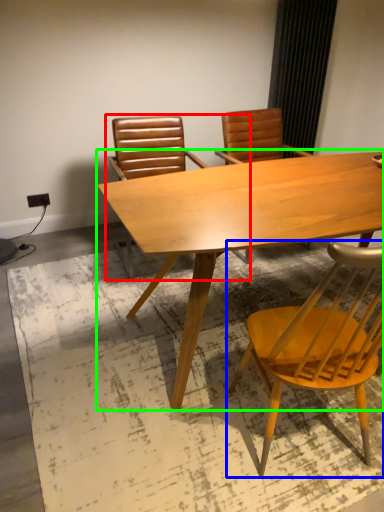
Question: Which object is the closest to the chair (highlighted by a red box)? Choose among these: chair (highlighted by a blue box) or table (highlighted by a green box).

Choices:
 (A) chair
 (B) table

Answer: (B)